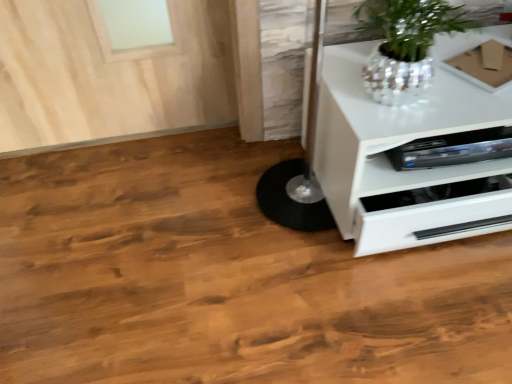
Locate an element on the screen. vacant space to the left of brown cardboard box at upper right is located at coordinates (435, 84).